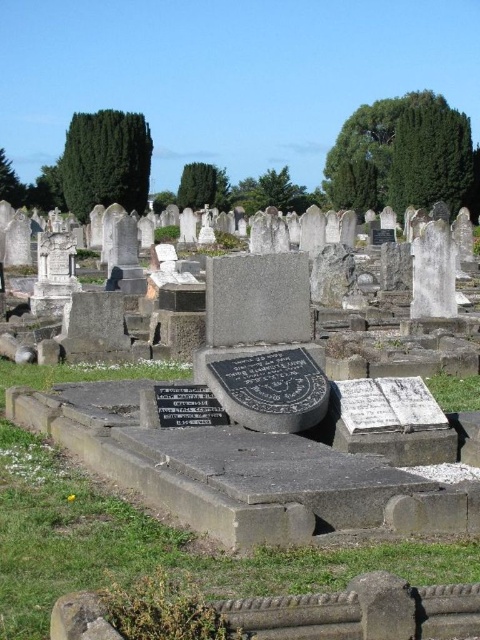
Can you confirm if granite gravestone at center is smaller than black polished stone plaque at center?

No.

Is granite gravestone at center thinner than black polished stone plaque at center?

No, granite gravestone at center is not thinner than black polished stone plaque at center.

Does point (383, 433) lie in front of point (171, 401)?

Yes, point (383, 433) is in front of point (171, 401).

Where is `granite gravestone at center`? granite gravestone at center is located at coordinates (240, 472).